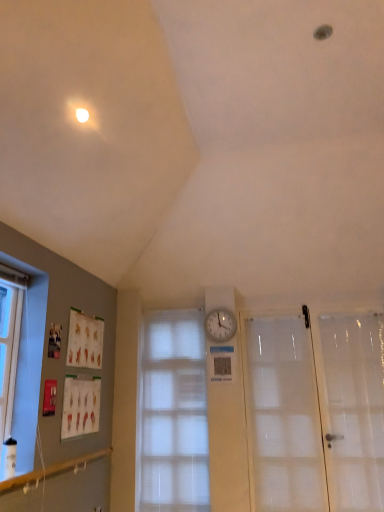
Question: Considering the relative sizes of transparent plastic screen door at right and translucent fabric window at center in the image provided, is transparent plastic screen door at right bigger than translucent fabric window at center?

Choices:
 (A) yes
 (B) no

Answer: (B)

Question: From a real-world perspective, is transparent plastic screen door at right under translucent fabric window at center?

Choices:
 (A) yes
 (B) no

Answer: (A)

Question: Is transparent plastic screen door at right far from translucent fabric window at center?

Choices:
 (A) yes
 (B) no

Answer: (A)

Question: Considering the relative sizes of transparent plastic screen door at right and translucent fabric window at center in the image provided, is transparent plastic screen door at right shorter than translucent fabric window at center?

Choices:
 (A) yes
 (B) no

Answer: (A)

Question: From a real-world perspective, is transparent plastic screen door at right located higher than translucent fabric window at center?

Choices:
 (A) no
 (B) yes

Answer: (A)

Question: Considering the positions of transparent plastic screen door at right and white frosted glass door at right in the image, is transparent plastic screen door at right wider or thinner than white frosted glass door at right?

Choices:
 (A) thin
 (B) wide

Answer: (B)

Question: From a real-world perspective, relative to white frosted glass door at right, is transparent plastic screen door at right vertically above or below?

Choices:
 (A) below
 (B) above

Answer: (A)

Question: In terms of size, does transparent plastic screen door at right appear bigger or smaller than white frosted glass door at right?

Choices:
 (A) big
 (B) small

Answer: (A)

Question: Is point (342, 392) closer or farther from the camera than point (307, 415)?

Choices:
 (A) farther
 (B) closer

Answer: (A)

Question: From a real-world perspective, is white frosted glass door at right physically located above or below white plastic clock at center?

Choices:
 (A) below
 (B) above

Answer: (A)

Question: Would you say white frosted glass door at right is to the left or to the right of white plastic clock at center in the picture?

Choices:
 (A) left
 (B) right

Answer: (B)

Question: Is point (274, 440) positioned closer to the camera than point (210, 334)?

Choices:
 (A) closer
 (B) farther

Answer: (A)

Question: Considering the positions of white frosted glass door at right and white plastic clock at center in the image, is white frosted glass door at right taller or shorter than white plastic clock at center?

Choices:
 (A) short
 (B) tall

Answer: (B)

Question: Which is correct: white plastic clock at center is inside white frosted glass door at right, or outside of it?

Choices:
 (A) inside
 (B) outside

Answer: (B)

Question: Is white plastic clock at center in front of or behind white frosted glass door at right in the image?

Choices:
 (A) behind
 (B) front

Answer: (A)